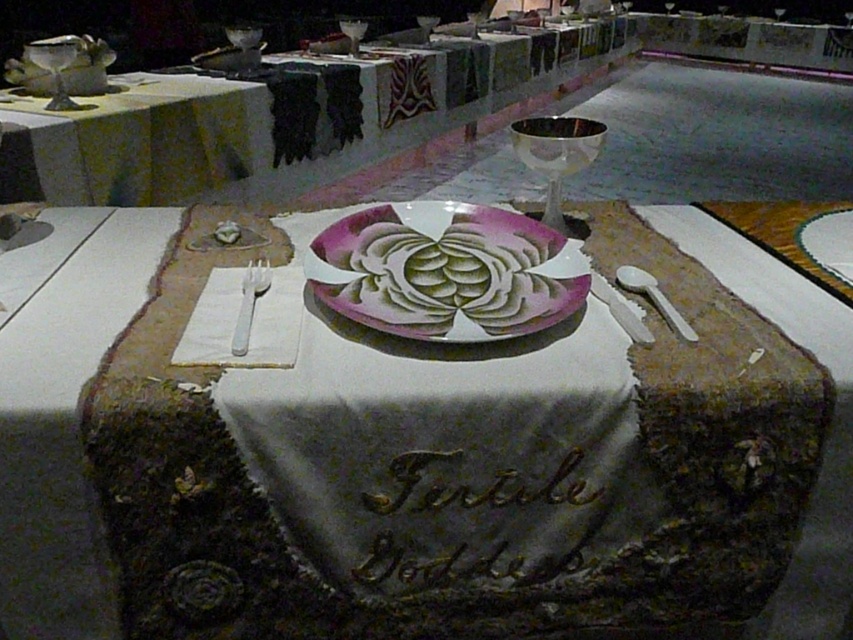
You are a guest at a formal dinner and you need to place your napkin on the table. The white fabric table at center is where you are sitting. Where exactly should you place your napkin in relation to the shiny silver wine glass at upper center?

The white fabric table at center is located below the shiny silver wine glass at upper center, so you should place your napkin below the shiny silver wine glass at upper center on the table.

You are a server at a banquet and need to place a 10 feet long tablecloth on the table. Considering the distance between the white fabric table at center and the shiny silver wine glass at upper center, will the tablecloth be long enough to cover the entire table?

The distance between the white fabric table at center and the shiny silver wine glass at upper center is 8.05 feet. Since the tablecloth is 10 feet long, it will be sufficient to cover the entire table.

You are a guest at a formal dinner and need to place your napkin on the table. If you are facing the white fabric table at center, where should you place your napkin in relation to the shiny silver wine glass at upper center?

The white fabric table at center is closer to you than the shiny silver wine glass at upper center, so you should place your napkin on the table closer to yourself, behind the wine glass.